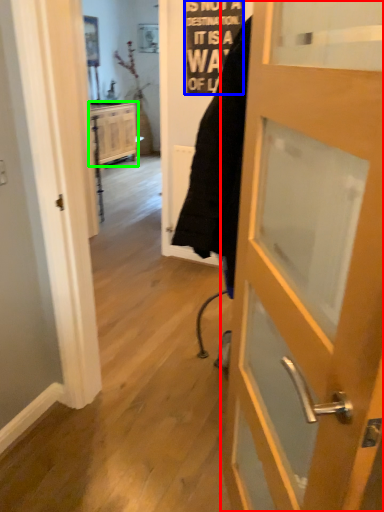
Question: Which object is positioned closest to door (highlighted by a red box)? Select from writing (highlighted by a blue box) and cabinetry (highlighted by a green box).

Choices:
 (A) writing
 (B) cabinetry

Answer: (A)